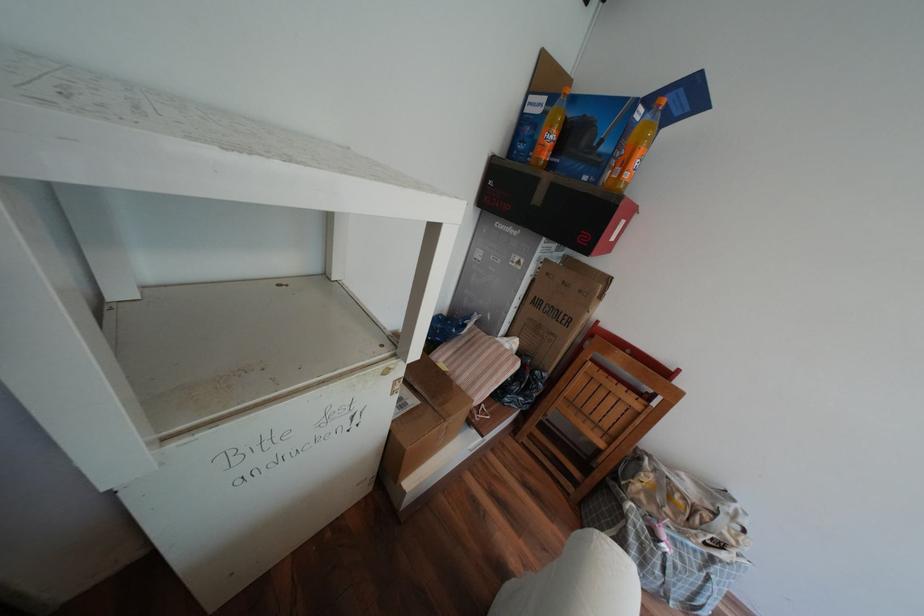
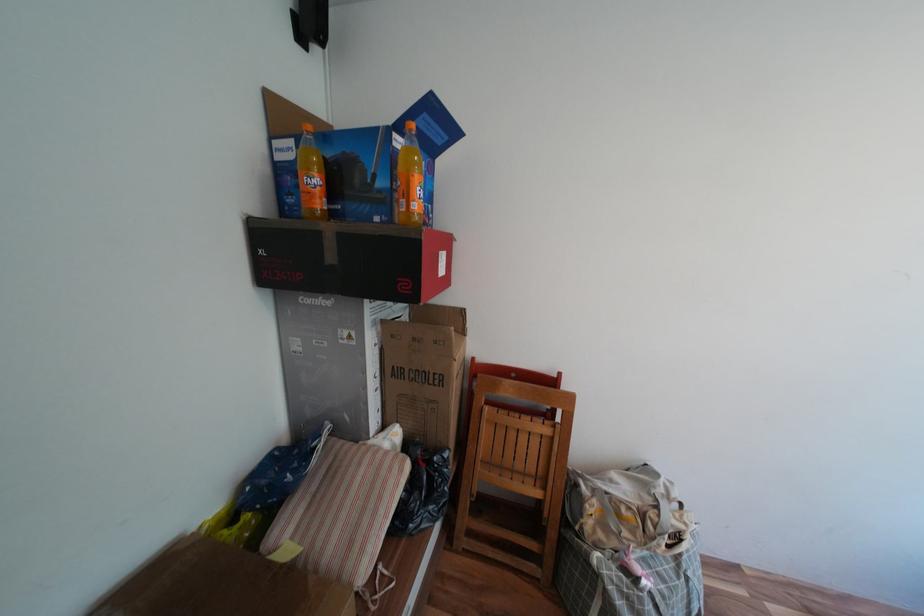
Question: The images are taken continuously from a first-person perspective. In which direction is your viewpoint rotating?

Choices:
 (A) Left
 (B) Right
 (C) Up
 (D) Down

Answer: (B)